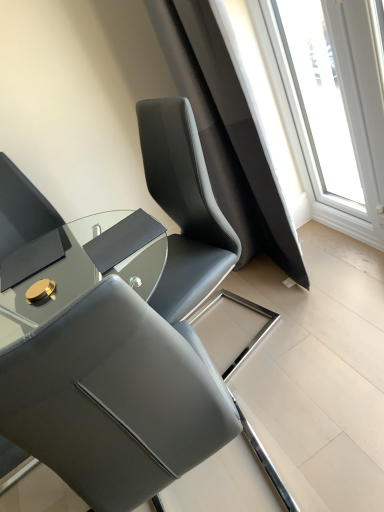
Locate an element on the screen. The width and height of the screenshot is (384, 512). matte gray chair at center is located at coordinates (114, 398).

This screenshot has width=384, height=512. Identify the location of shiny black glass table at center. (80, 266).

Can you confirm if matte gray chair at center is positioned to the right of shiny black glass table at center?

Yes.

Identify the location of chair that is in front of the shiny black glass table at center. (114, 398).

From the image's perspective, is matte gray chair at center above or below shiny black glass table at center?

Clearly, from the image's perspective, matte gray chair at center is below shiny black glass table at center.

From a real-world perspective, between matte gray chair at center and shiny black glass table at center, who is vertically higher?

shiny black glass table at center, from a real-world perspective.

Would you say shiny black glass table at center is a long distance from matte gray chair at center?

No, there isn't a large distance between shiny black glass table at center and matte gray chair at center.

In the image, is shiny black glass table at center positioned in front of or behind matte gray chair at center?

shiny black glass table at center is behind matte gray chair at center.

What's the angular difference between shiny black glass table at center and matte gray chair at center's facing directions?

shiny black glass table at center and matte gray chair at center are facing 2.48 degrees away from each other.

Does point (147, 272) come farther from viewer compared to point (208, 411)?

Yes, it is behind point (208, 411).

Can you confirm if transparent glass window at upper right is wider than matte gray chair at center?

Incorrect, the width of transparent glass window at upper right does not surpass that of matte gray chair at center.

From the image's perspective, is transparent glass window at upper right located beneath matte gray chair at center?

Incorrect, from the image's perspective, transparent glass window at upper right is higher than matte gray chair at center.

Looking at this image, from a real-world perspective, is transparent glass window at upper right beneath matte gray chair at center?

No.

Is point (137, 447) in front of point (357, 88)?

Yes, point (137, 447) is closer to viewer.

Choose the correct answer: Is matte gray chair at center inside transparent glass window at upper right or outside it?

matte gray chair at center is not inside transparent glass window at upper right, it's outside.

Where is `chair in front of the transparent glass window at upper right`? chair in front of the transparent glass window at upper right is located at coordinates (114, 398).

What's the angular difference between matte gray chair at center and transparent glass window at upper right's facing directions?

There is a 94.8-degree angle between the facing directions of matte gray chair at center and transparent glass window at upper right.

Is shiny black glass table at center facing away from transparent glass window at upper right?

No, shiny black glass table at center is not facing away from transparent glass window at upper right.

The height and width of the screenshot is (512, 384). In order to click on table below the transparent glass window at upper right (from the image's perspective) in this screenshot , I will do `click(80, 266)`.

From a real-world perspective, is shiny black glass table at center physically located above or below transparent glass window at upper right?

shiny black glass table at center is above transparent glass window at upper right.

From the image's perspective, which one is positioned lower, shiny black glass table at center or transparent glass window at upper right?

shiny black glass table at center appears lower in the image.

Are transparent glass window at upper right and shiny black glass table at center making contact?

No, transparent glass window at upper right is not touching shiny black glass table at center.

Which of these two, transparent glass window at upper right or shiny black glass table at center, is bigger?

shiny black glass table at center is bigger.

Is transparent glass window at upper right to the right of shiny black glass table at center from the viewer's perspective?

Yes, transparent glass window at upper right is to the right of shiny black glass table at center.

From the image's perspective, relative to shiny black glass table at center, is transparent glass window at upper right above or below?

Clearly, from the image's perspective, transparent glass window at upper right is above shiny black glass table at center.

Where is `table located on the left of matte gray chair at center`? This screenshot has width=384, height=512. table located on the left of matte gray chair at center is located at coordinates (80, 266).

I want to click on table above the matte gray chair at center (from the image's perspective), so click(x=80, y=266).

Consider the image. Looking at the image, which one is located closer to matte gray chair at center, transparent glass window at upper right or shiny black glass table at center?

Among the two, shiny black glass table at center is located nearer to matte gray chair at center.

When comparing their distances from shiny black glass table at center, does transparent glass window at upper right or matte gray chair at center seem further?

transparent glass window at upper right is further to shiny black glass table at center.

Estimate the real-world distances between objects in this image. Which object is further from shiny black glass table at center, matte gray chair at center or transparent glass window at upper right?

Among the two, transparent glass window at upper right is located further to shiny black glass table at center.

Considering their positions, is matte gray chair at center positioned closer to transparent glass window at upper right than shiny black glass table at center?

shiny black glass table at center is closer to transparent glass window at upper right.

When comparing their distances from transparent glass window at upper right, does shiny black glass table at center or matte gray chair at center seem further?

matte gray chair at center is further to transparent glass window at upper right.

When comparing their distances from matte gray chair at center, does shiny black glass table at center or transparent glass window at upper right seem closer?

shiny black glass table at center is closer to matte gray chair at center.

The width and height of the screenshot is (384, 512). I want to click on chair situated between shiny black glass table at center and transparent glass window at upper right from left to right, so click(x=114, y=398).